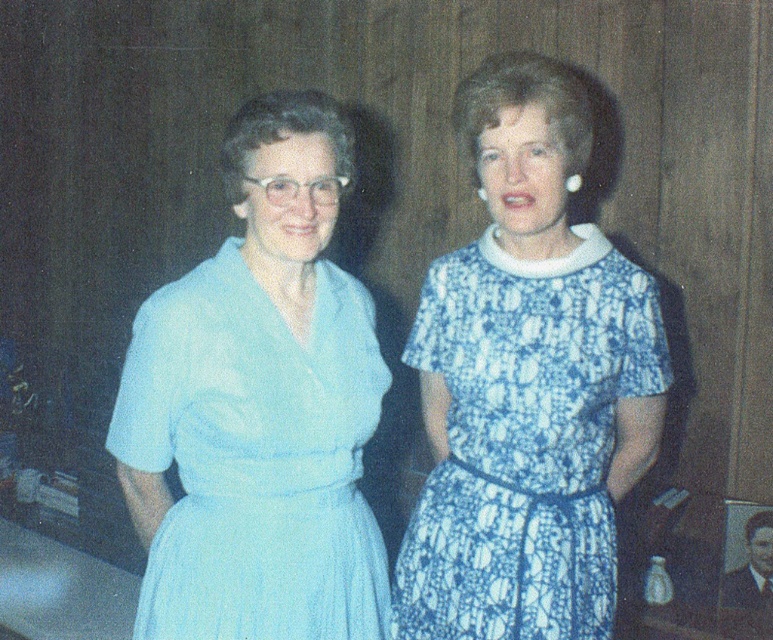
Question: In this image, where is light blue fabric dress at left located relative to blue printed dress at center?

Choices:
 (A) right
 (B) left

Answer: (B)

Question: Which object is farther from the camera taking this photo?

Choices:
 (A) blue printed dress at center
 (B) light blue fabric dress at left

Answer: (A)

Question: Is light blue fabric dress at left bigger than blue printed dress at center?

Choices:
 (A) yes
 (B) no

Answer: (A)

Question: Is light blue fabric dress at left to the left of blue printed dress at center from the viewer's perspective?

Choices:
 (A) no
 (B) yes

Answer: (B)